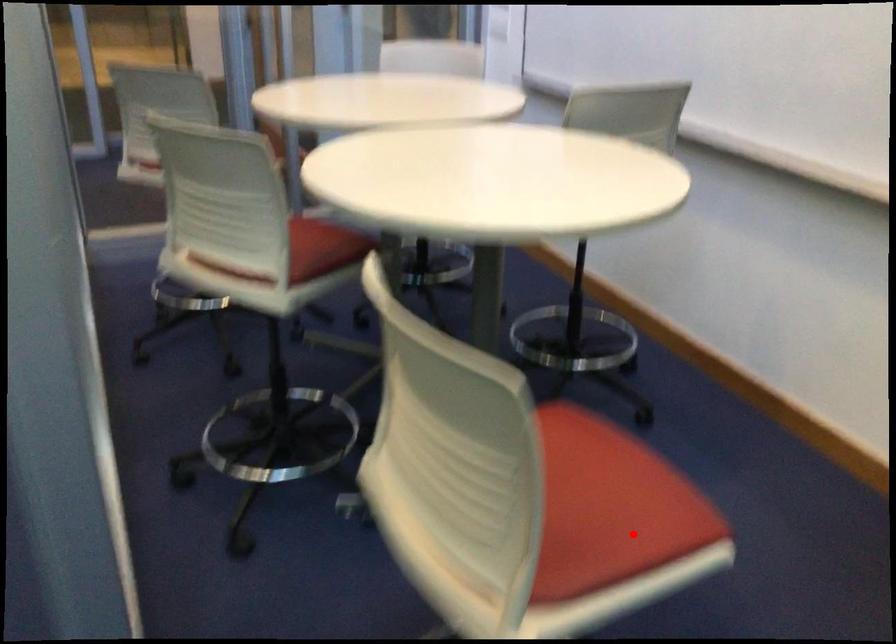
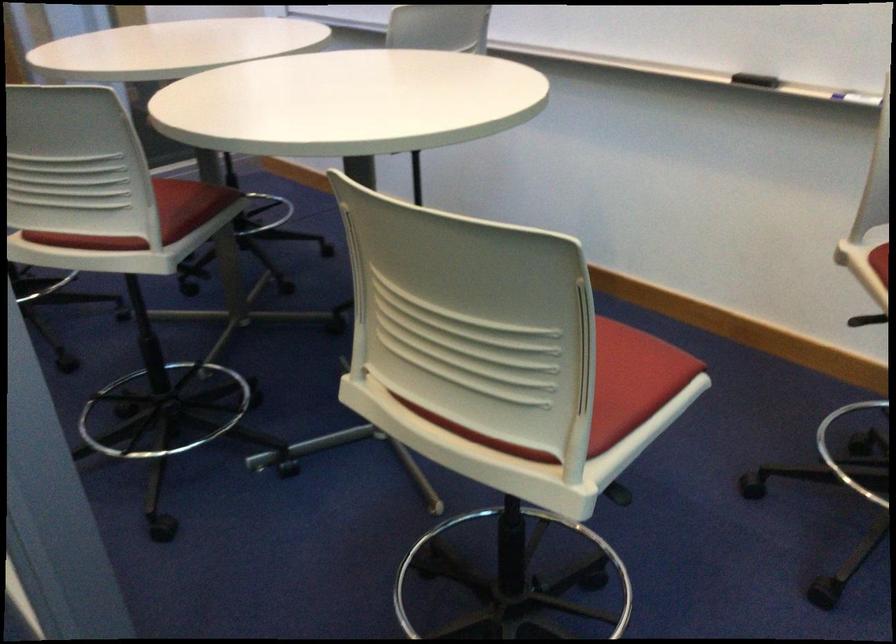
Find the pixel in the second image that matches the highlighted location in the first image.

(633, 380)